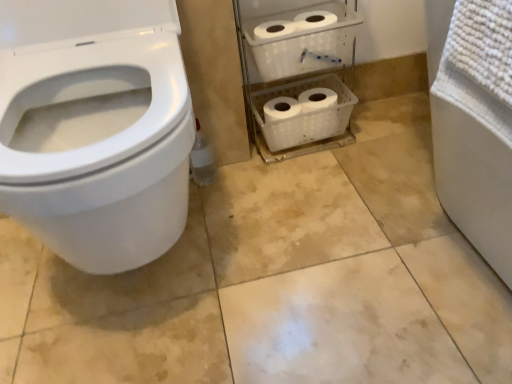
The height and width of the screenshot is (384, 512). I want to click on vacant space underneath white glossy toilet at left (from a real-world perspective), so click(147, 286).